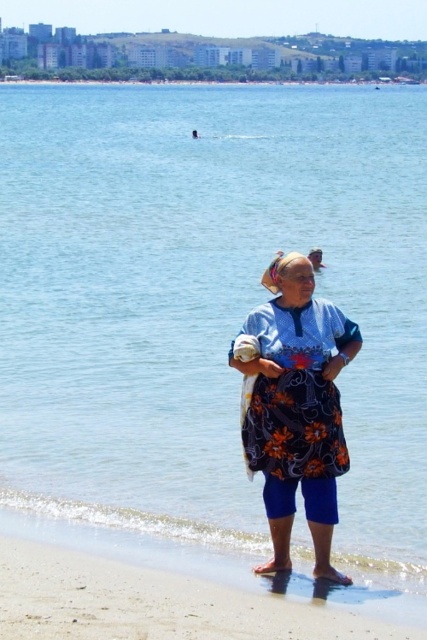
Is sandy beach at lower center shorter than floral-patterned fabric dress at center?

Indeed, sandy beach at lower center has a lesser height compared to floral-patterned fabric dress at center.

Is sandy beach at lower center wider than floral-patterned fabric dress at center?

Yes, sandy beach at lower center is wider than floral-patterned fabric dress at center.

Locate an element on the screen. The image size is (427, 640). sandy beach at lower center is located at coordinates (155, 604).

In order to click on sandy beach at lower center in this screenshot , I will do `click(155, 604)`.

Does sandy beach at lower center have a lesser height compared to floral fabric apron at center?

Correct, sandy beach at lower center is not as tall as floral fabric apron at center.

Is sandy beach at lower center positioned before floral fabric apron at center?

Yes, it is.

This screenshot has height=640, width=427. I want to click on sandy beach at lower center, so click(155, 604).

Does floral-patterned fabric dress at center have a greater height compared to floral fabric apron at center?

Correct, floral-patterned fabric dress at center is much taller as floral fabric apron at center.

Does point (300, 340) lie in front of point (324, 403)?

Yes, point (300, 340) is closer to viewer.

Is point (297, 460) closer to viewer compared to point (287, 362)?

No, (297, 460) is further to viewer.

Where is `floral-patterned fabric dress at center`? floral-patterned fabric dress at center is located at coordinates (297, 406).